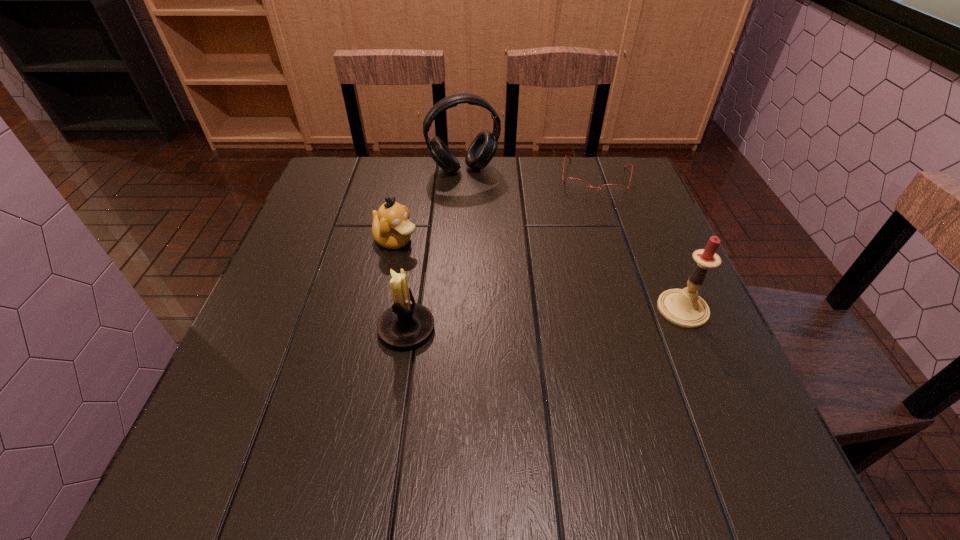
This screenshot has height=540, width=960. I want to click on candle holder, so click(405, 324).

The height and width of the screenshot is (540, 960). In order to click on candle in this screenshot , I will do `click(684, 307)`.

In order to click on duckling in this screenshot , I will do `click(391, 228)`.

The height and width of the screenshot is (540, 960). I want to click on the fourth tallest object, so click(x=391, y=228).

Image resolution: width=960 pixels, height=540 pixels. Find the location of `headset`. headset is located at coordinates (483, 148).

This screenshot has width=960, height=540. Identify the location of the shortest object. (576, 185).

Find the location of a particular element. free location located on the back of the candle holder is located at coordinates (422, 225).

Find the location of `free space located on the left of the candle`. free space located on the left of the candle is located at coordinates (604, 309).

This screenshot has height=540, width=960. In order to click on free space located 0.180m on the face of the duckling in this screenshot , I will do `click(475, 282)`.

Locate an element on the screen. Image resolution: width=960 pixels, height=540 pixels. free space located 0.260m on the face of the duckling is located at coordinates (506, 299).